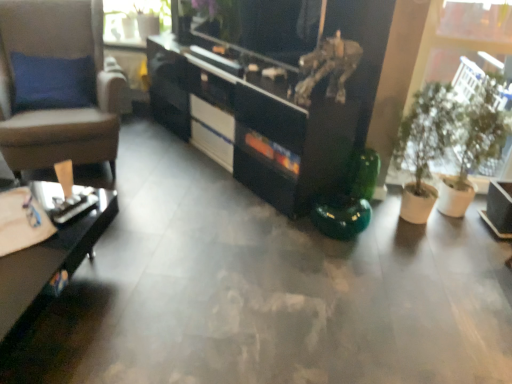
This screenshot has width=512, height=384. I want to click on free space above black glossy desk at lower left (from a real-world perspective), so click(x=40, y=228).